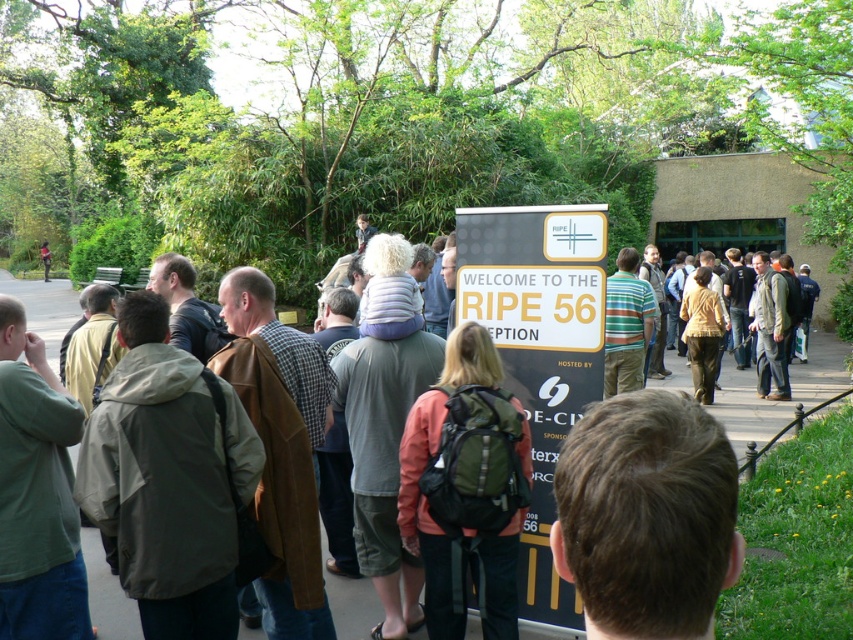
Is point (567, 209) positioned after point (459, 444)?

That is True.

I want to click on yellow plastic sign at center, so click(538, 348).

Who is more distant from viewer, (543,365) or (483,598)?

Point (543,365)

I want to click on yellow plastic sign at center, so click(x=538, y=348).

Between brown hair at center and reddish-orange backpack at center, which one appears on the right side from the viewer's perspective?

From the viewer's perspective, brown hair at center appears more on the right side.

Who is taller, brown hair at center or reddish-orange backpack at center?

reddish-orange backpack at center

This screenshot has height=640, width=853. I want to click on brown hair at center, so click(646, 515).

In order to click on brown hair at center in this screenshot , I will do (646, 515).

Who is shorter, brown hair at center or yellow plastic sign at center?

With less height is brown hair at center.

Between brown hair at center and yellow plastic sign at center, which one is positioned lower?

Positioned lower is yellow plastic sign at center.

I want to click on brown hair at center, so click(x=646, y=515).